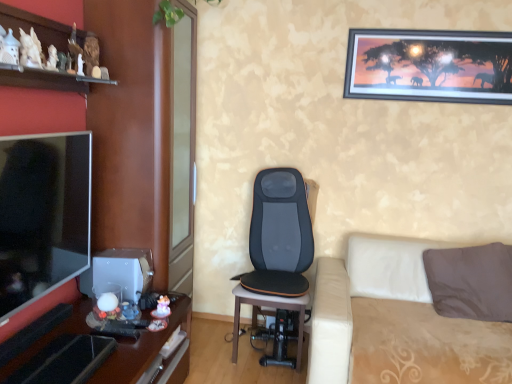
Locate an element on the screen. The image size is (512, 384). free space above metallic-framed picture at upper right (from a real-world perspective) is located at coordinates (425, 28).